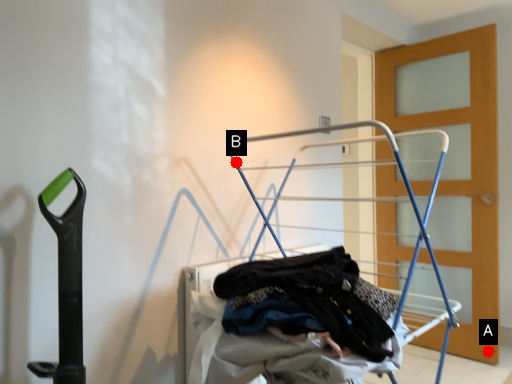
Question: Two points are circled on the image, labeled by A and B beside each circle. Among these points, which one is farthest from the camera?

Choices:
 (A) A is further
 (B) B is further

Answer: (A)